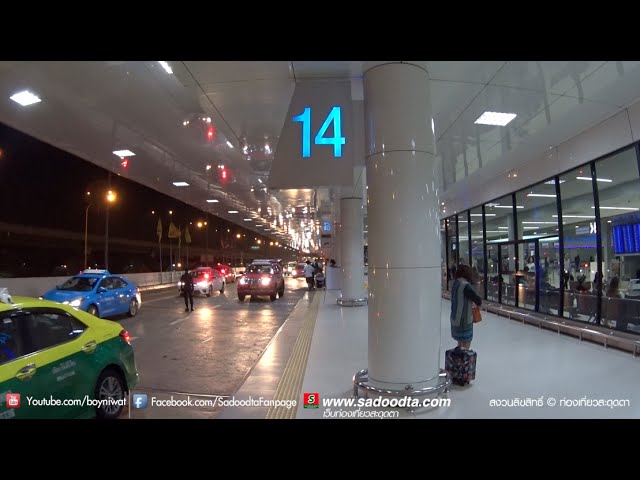
Identify the location of shiney white column. (413, 244).